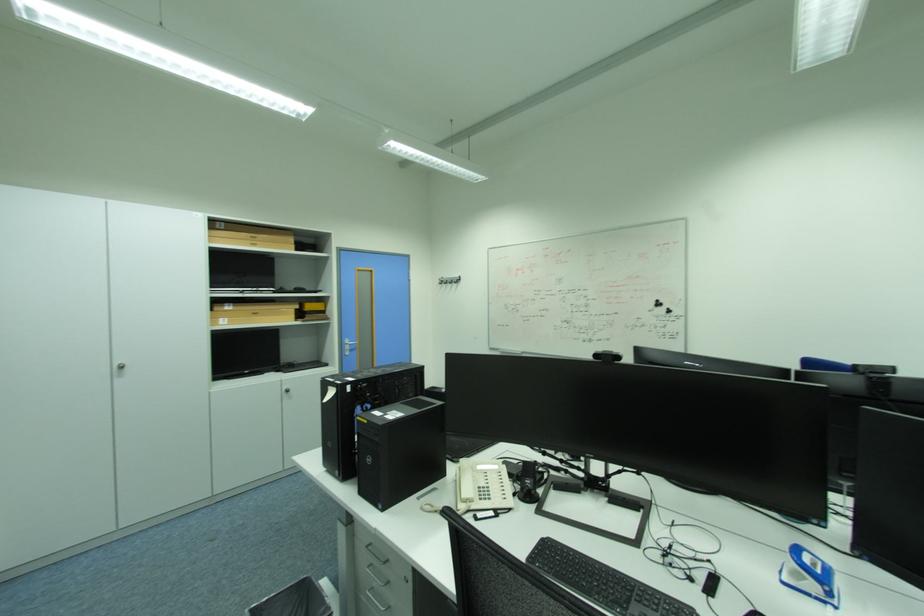
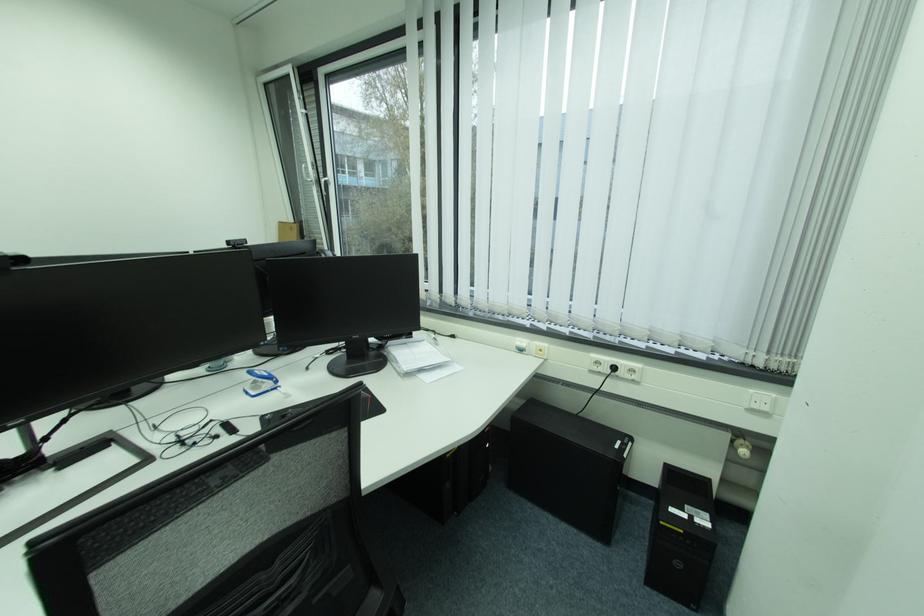
Where in the second image is the point corresponding to pixel 822 589 from the first image?

(275, 386)